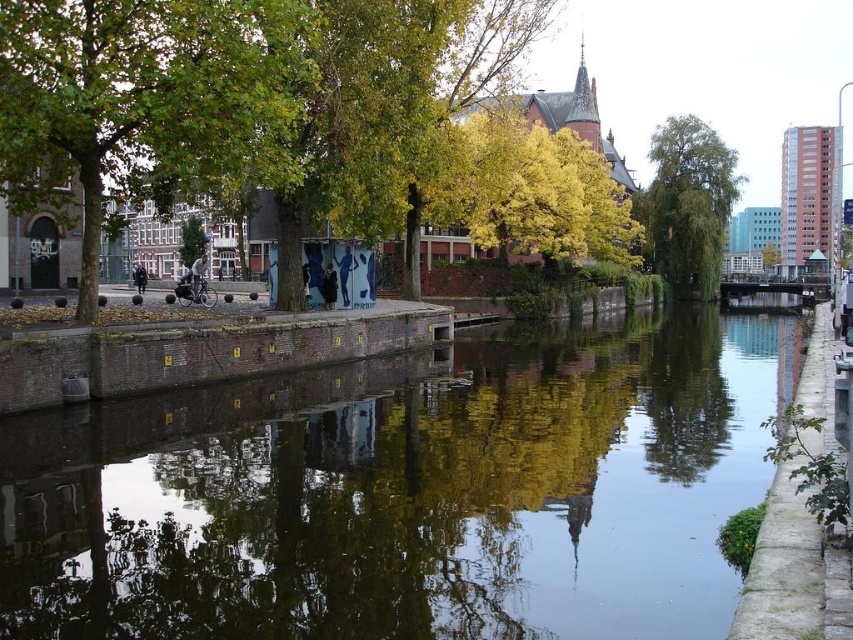
Question: Considering the relative positions of green leafy tree at left and green matte tree at center in the image provided, where is green leafy tree at left located with respect to green matte tree at center?

Choices:
 (A) above
 (B) below

Answer: (B)

Question: Does smooth concrete canal at center appear over green matte tree at center?

Choices:
 (A) yes
 (B) no

Answer: (B)

Question: Which point is farther to the camera?

Choices:
 (A) (143, 60)
 (B) (187, 237)
 (C) (688, 180)

Answer: (B)

Question: Which point is farther from the camera taking this photo?

Choices:
 (A) (769, 248)
 (B) (186, 257)
 (C) (685, 248)

Answer: (A)

Question: Can you confirm if green leafy tree at center is wider than yellow matte tree at center?

Choices:
 (A) no
 (B) yes

Answer: (B)

Question: Which is farther from the green leafy tree at left?

Choices:
 (A) green leafy tree at center
 (B) green matte tree at center
 (C) yellow matte tree at center
 (D) smooth concrete canal at center

Answer: (C)